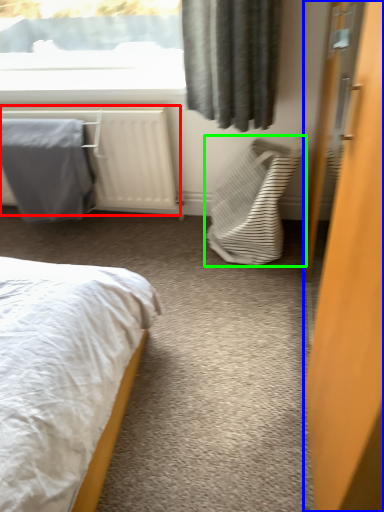
Question: Estimate the real-world distances between objects in this image. Which object is farther from radiator (highlighted by a red box), door (highlighted by a blue box) or laundry basket (highlighted by a green box)?

Choices:
 (A) door
 (B) laundry basket

Answer: (A)